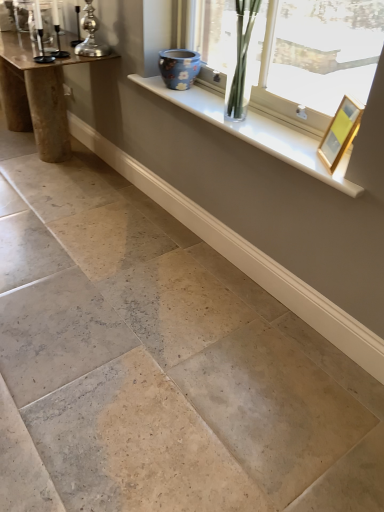
Question: From the image's perspective, is silver metallic candle holder at upper left, arranged as the first candle holder when viewed from the right, over natural stone floor at center?

Choices:
 (A) no
 (B) yes

Answer: (B)

Question: Is silver metallic candle holder at upper left, the second candle holder viewed from the left, not near natural stone floor at center?

Choices:
 (A) no
 (B) yes

Answer: (B)

Question: Would you say silver metallic candle holder at upper left, arranged as the first candle holder when viewed from the right, is outside natural stone floor at center?

Choices:
 (A) no
 (B) yes

Answer: (B)

Question: From a real-world perspective, is silver metallic candle holder at upper left, arranged as the first candle holder when viewed from the right, positioned under natural stone floor at center based on gravity?

Choices:
 (A) yes
 (B) no

Answer: (B)

Question: Can you confirm if silver metallic candle holder at upper left, arranged as the first candle holder when viewed from the right, is shorter than natural stone floor at center?

Choices:
 (A) yes
 (B) no

Answer: (B)

Question: From a real-world perspective, is metallic silver candle holder at left, the second candle holder when ordered from right to left, above or below clear glass vase at upper center?

Choices:
 (A) above
 (B) below

Answer: (A)

Question: Based on their positions, is metallic silver candle holder at left, the 1th candle holder in the left-to-right sequence, located to the left or right of clear glass vase at upper center?

Choices:
 (A) left
 (B) right

Answer: (A)

Question: Looking at the image, does metallic silver candle holder at left, the second candle holder when ordered from right to left, seem bigger or smaller compared to clear glass vase at upper center?

Choices:
 (A) big
 (B) small

Answer: (B)

Question: Is point (34, 2) positioned closer to the camera than point (296, 67)?

Choices:
 (A) farther
 (B) closer

Answer: (A)

Question: In terms of height, does silver metallic candle holder at upper left, the second candle holder viewed from the left, look taller or shorter compared to gold metallic picture frame at upper right?

Choices:
 (A) short
 (B) tall

Answer: (B)

Question: Looking at their shapes, would you say silver metallic candle holder at upper left, the second candle holder viewed from the left, is wider or thinner than gold metallic picture frame at upper right?

Choices:
 (A) wide
 (B) thin

Answer: (A)

Question: From a real-world perspective, is silver metallic candle holder at upper left, the second candle holder viewed from the left, positioned above or below gold metallic picture frame at upper right?

Choices:
 (A) below
 (B) above

Answer: (B)

Question: Is silver metallic candle holder at upper left, the second candle holder viewed from the left, in front of or behind gold metallic picture frame at upper right in the image?

Choices:
 (A) front
 (B) behind

Answer: (B)

Question: Considering the positions of natural stone floor at center and blue floral ceramic vase at upper center in the image, is natural stone floor at center wider or thinner than blue floral ceramic vase at upper center?

Choices:
 (A) thin
 (B) wide

Answer: (B)

Question: Does point (54, 493) appear closer or farther from the camera than point (188, 80)?

Choices:
 (A) farther
 (B) closer

Answer: (B)